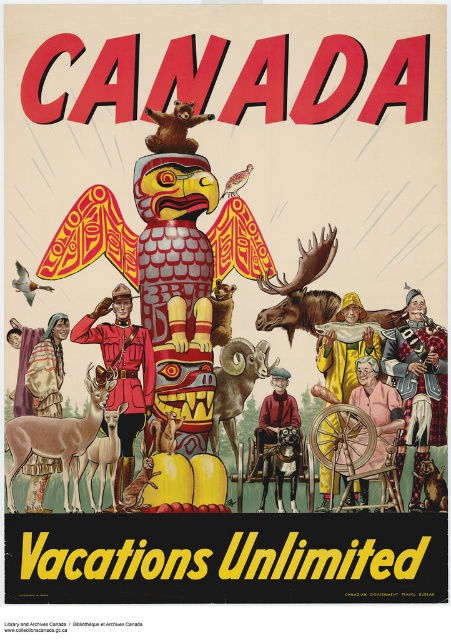
Question: Can you confirm if brown woolly ram at center is thinner than brown furry bear at upper center?

Choices:
 (A) yes
 (B) no

Answer: (A)

Question: Which point is farther to the camera?

Choices:
 (A) shiny black horse at center
 (B) fluffy brown cat at lower right

Answer: (A)

Question: Can you confirm if brown velvet deer at lower left is thinner than brown furry squirrel at center?

Choices:
 (A) no
 (B) yes

Answer: (A)

Question: Which point is closer to the camera taking this photo?

Choices:
 (A) (258, 378)
 (B) (263, 492)

Answer: (B)

Question: Can you confirm if light brown fur deer at lower left is bigger than brown fur squirrel at lower center?

Choices:
 (A) no
 (B) yes

Answer: (B)

Question: Which point is farther from the camera taking this photo?

Choices:
 (A) (289, 440)
 (B) (224, 346)
 (C) (153, 419)

Answer: (B)